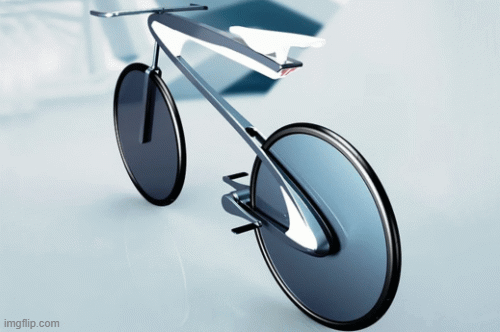
Locate an element on the screen. This screenshot has width=500, height=332. bar is located at coordinates (204, 55).